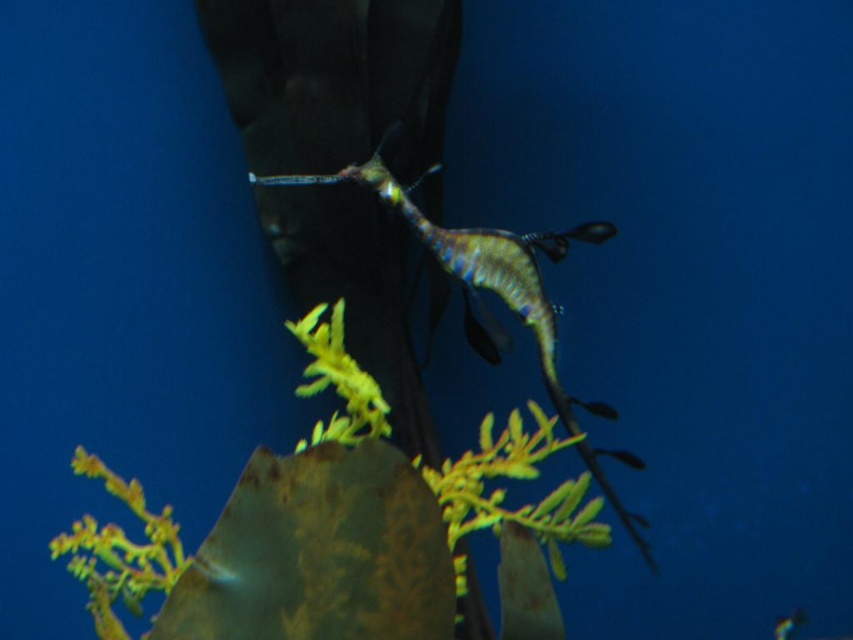
Question: Is green leafy plant at center bigger than shiny silver fish at center?

Choices:
 (A) no
 (B) yes

Answer: (B)

Question: Which point is farther from the camera taking this photo?

Choices:
 (A) (544, 250)
 (B) (341, 616)

Answer: (A)

Question: Which object is positioned farthest from the green leafy plant at center?

Choices:
 (A) green iridescent seahorse at center
 (B) shiny silver fish at center

Answer: (B)

Question: Among these objects, which one is nearest to the camera?

Choices:
 (A) green iridescent seahorse at center
 (B) shiny silver fish at center
 (C) green leafy plant at center

Answer: (C)

Question: Does green iridescent seahorse at center have a lesser width compared to shiny silver fish at center?

Choices:
 (A) no
 (B) yes

Answer: (A)

Question: Does green leafy plant at center have a smaller size compared to shiny silver fish at center?

Choices:
 (A) no
 (B) yes

Answer: (A)